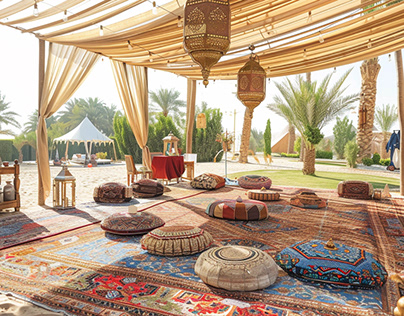
Where is `rug`? The height and width of the screenshot is (316, 404). rug is located at coordinates (89, 275).